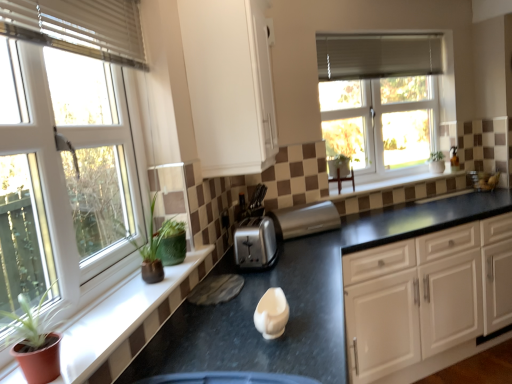
The height and width of the screenshot is (384, 512). What are the coordinates of `free spot below white fabric blinds at upper left, which is the 2th blind from back to front (from a real-world perspective)` in the screenshot? It's located at (103, 315).